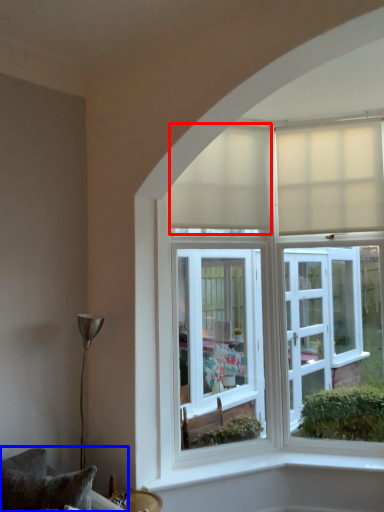
Question: Among these objects, which one is farthest to the camera, curtain (highlighted by a red box) or furniture (highlighted by a blue box)?

Choices:
 (A) curtain
 (B) furniture

Answer: (A)